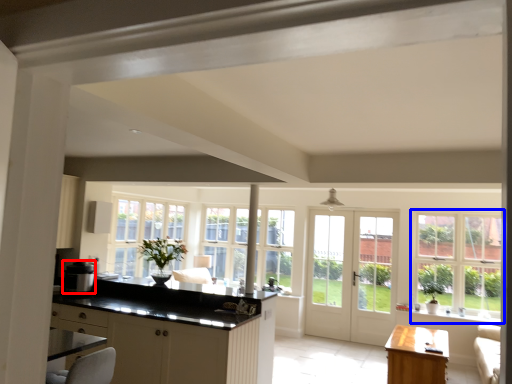
Question: Among these objects, which one is nearest to the camera, appliance (highlighted by a red box) or window (highlighted by a blue box)?

Choices:
 (A) appliance
 (B) window

Answer: (A)